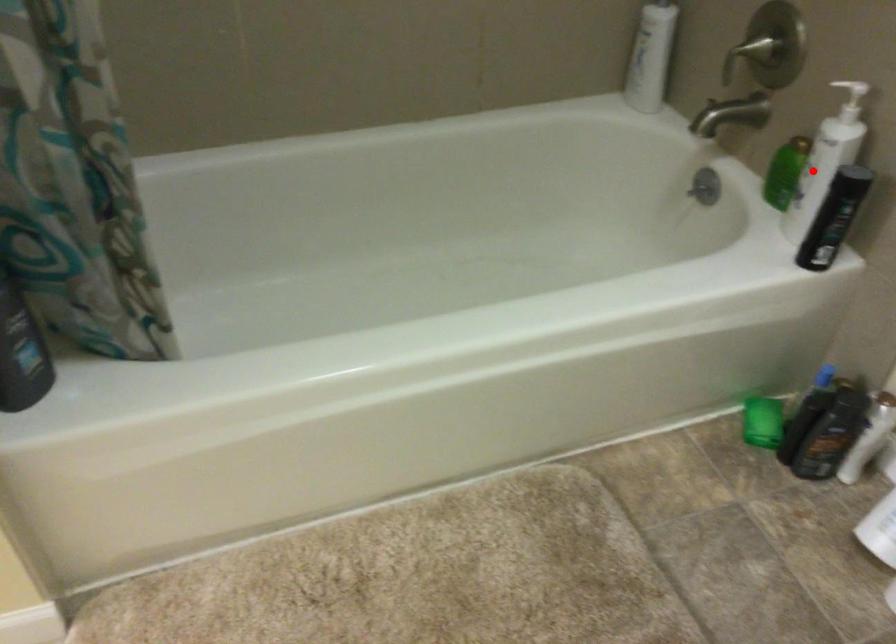
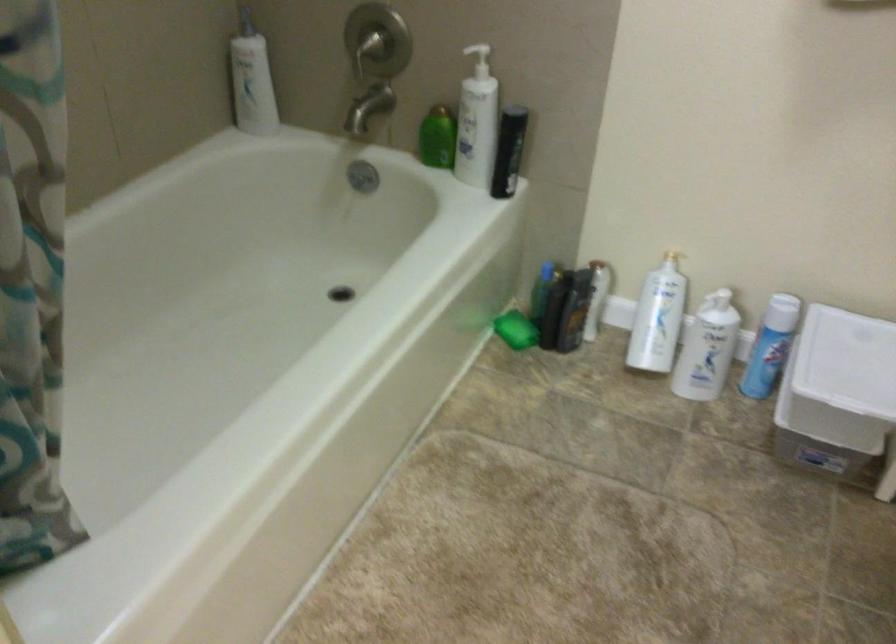
Question: I am providing you with two images of the same scene from different viewpoints. Image1 has a red point marked. In image2, the corresponding 3D location appears at what relative position? Reply with the corresponding letter.

Choices:
 (A) Closer
 (B) Farther

Answer: (B)